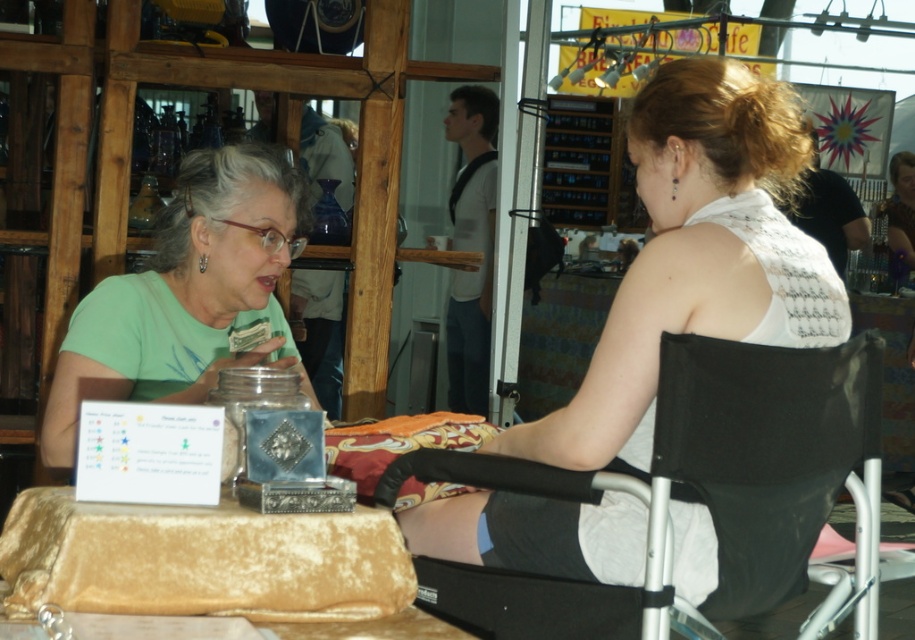
You are standing at the origin of the coordinate system in the image. The black fabric folding chair at right is located at point (763,451). If you want to walk directly towards it, which direction should you move in terms of the coordinate system?

The black fabric folding chair at right is located at coordinates (763,451). Since the origin is at the bottom left corner of the image, moving towards increasing x and y values would mean moving to the right and upwards. Therefore, to reach the chair at (763,451), you should move to the right and upwards from the origin.

You are planning to set up a booth at an event and need to decide seating arrangements. You have a visitor who is 1.8 meters tall and needs to sit comfortably. Given the black fabric folding chair at right and the green matte shirt at left, which chair would you recommend based on size?

The black fabric folding chair at right has a smaller size compared to the green matte shirt at left. Since the visitor is 1.8 meters tall, the larger chair, which is the green matte shirt at left, would be more comfortable for them.

You are a photographer standing at the back of the market. You want to take a photo of the white lace tank top at center and the green matte shirt at left. Which one will appear larger in your photo?

The white lace tank top at center will appear larger in the photo because it is closer to the viewer than the green matte shirt at left.